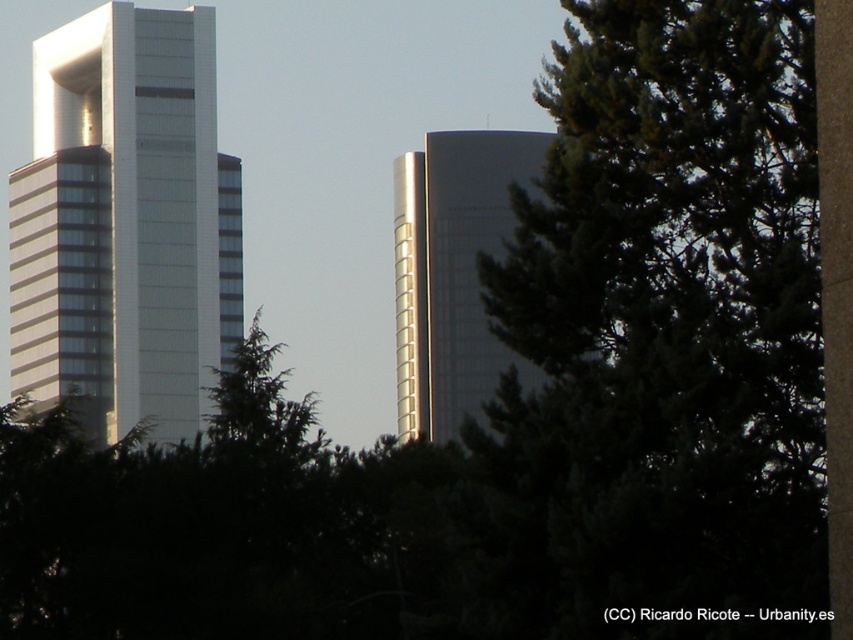
You are standing in front of the cityscape with two skyscrapers. You notice two points marked on the image at coordinates point (508, 440) and point (437, 241). Which point is closer to your viewpoint?

Point (508, 440) is closer to the camera than point (437, 241).

You are a city planner assessing the skyline. Which of the two buildings, the white glass building at left or the glossy glass tower at center, has a larger footprint based on their visible size in the scene?

The white glass building at left is bigger than the glossy glass tower at center, so it likely has a larger footprint.